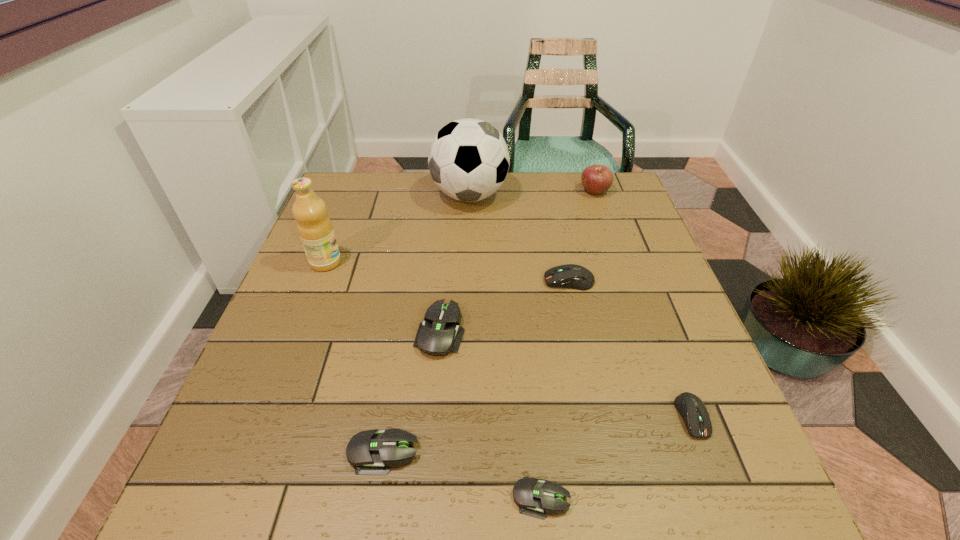
Image resolution: width=960 pixels, height=540 pixels. Find the location of `gray computer mouse that is the nearest to the soccer ball`. gray computer mouse that is the nearest to the soccer ball is located at coordinates [x=439, y=333].

Where is `free spot that satisfies the following two spatial constraints: 1. on the label of the leftmost object; 2. on the right side of the farthest gray computer mouse`? Image resolution: width=960 pixels, height=540 pixels. free spot that satisfies the following two spatial constraints: 1. on the label of the leftmost object; 2. on the right side of the farthest gray computer mouse is located at coordinates (299, 332).

Find the location of `free location that satisfies the following two spatial constraints: 1. on the back side of the biggest gray computer mouse; 2. on the left side of the second smallest gray computer mouse`. free location that satisfies the following two spatial constraints: 1. on the back side of the biggest gray computer mouse; 2. on the left side of the second smallest gray computer mouse is located at coordinates point(403,332).